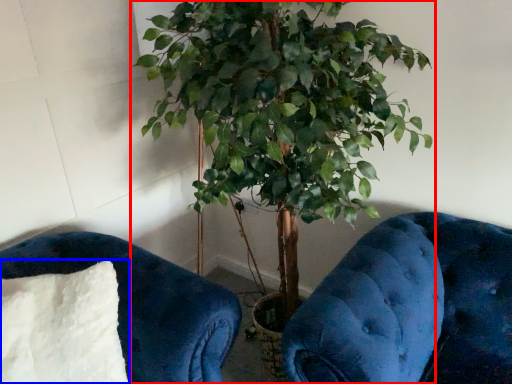
Question: Among these objects, which one is nearest to the camera, houseplant (highlighted by a red box) or pillow (highlighted by a blue box)?

Choices:
 (A) houseplant
 (B) pillow

Answer: (A)